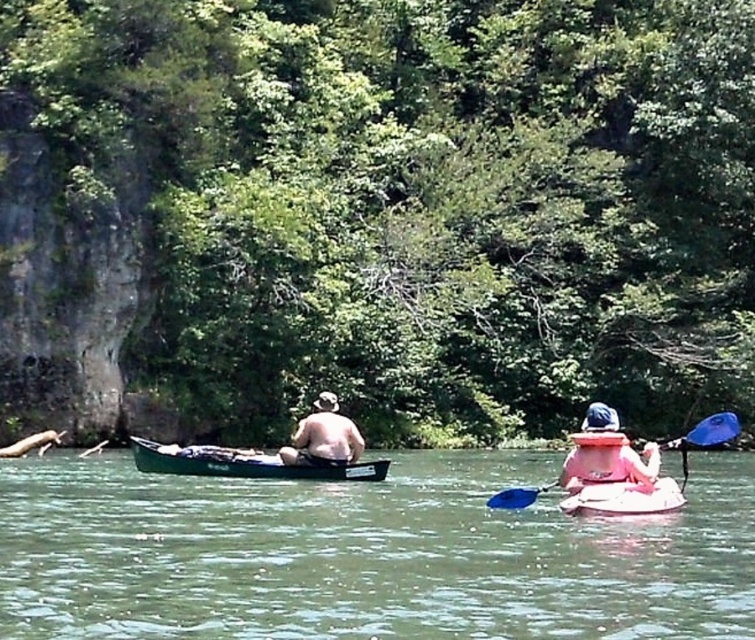
Who is more forward, (276, 566) or (347, 435)?

Point (276, 566) is more forward.

Which is more to the right, green rubber boat at center or skinny white man at center?

green rubber boat at center is more to the right.

Identify the location of green rubber boat at center. This screenshot has width=755, height=640. (365, 554).

Between pink life vest at right and skinny white man at center, which one is positioned higher?

Positioned higher is skinny white man at center.

Does pink life vest at right come in front of skinny white man at center?

Yes, pink life vest at right is closer to the viewer.

Between point (638, 477) and point (353, 461), which one is positioned in front?

Point (638, 477) is in front.

Where is `pink life vest at right`? Image resolution: width=755 pixels, height=640 pixels. pink life vest at right is located at coordinates (609, 465).

Can you confirm if pink life vest at right is wider than blue plastic paddle at center?

No.

Can you confirm if pink life vest at right is taller than blue plastic paddle at center?

No, pink life vest at right is not taller than blue plastic paddle at center.

The image size is (755, 640). I want to click on pink life vest at right, so click(x=609, y=465).